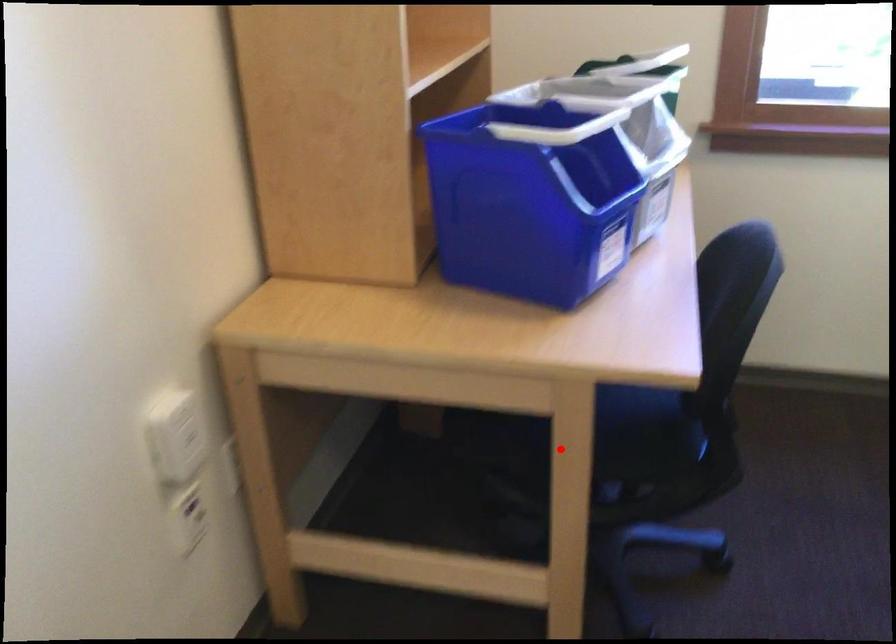
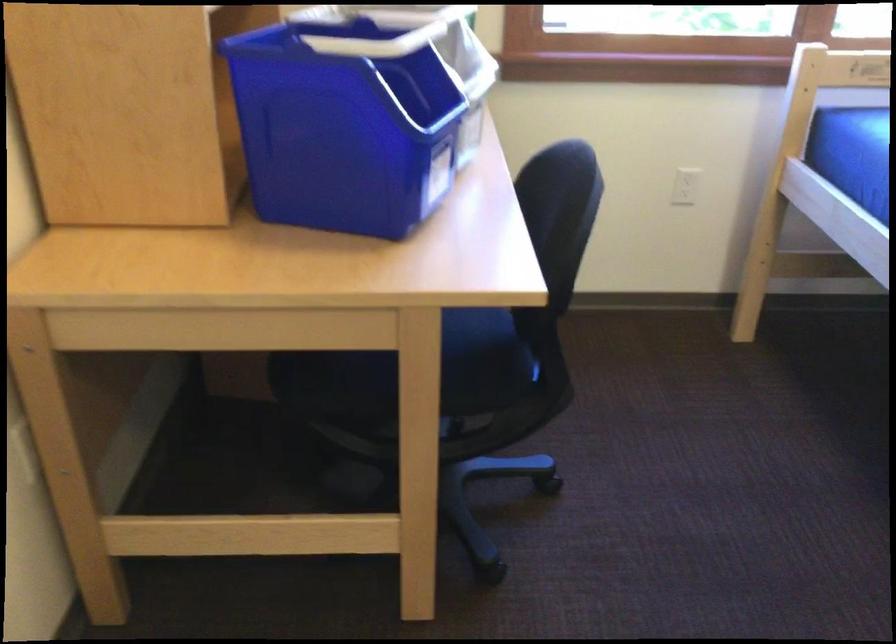
In the second image, find the point that corresponds to the highlighted location in the first image.

(409, 384)